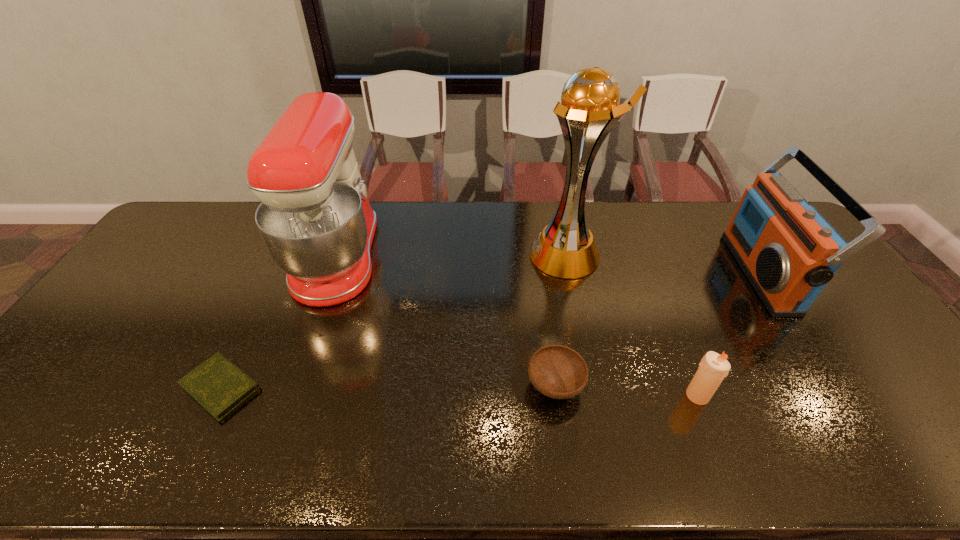
The height and width of the screenshot is (540, 960). What are the coordinates of `blank space that satisfies the following two spatial constraints: 1. on the front side of the candle; 2. on the left side of the shortest object` in the screenshot? It's located at [x=217, y=395].

This screenshot has height=540, width=960. In order to click on vacant area in the image that satisfies the following two spatial constraints: 1. on the front-facing side of the fifth tallest object; 2. on the left side of the mixer in this screenshot , I will do `click(293, 386)`.

Locate an element on the screen. This screenshot has height=540, width=960. free region that satisfies the following two spatial constraints: 1. on the front-facing side of the second object from right to left; 2. on the left side of the second tallest object is located at coordinates (290, 395).

Where is `vacant space that satisfies the following two spatial constraints: 1. on the front-facing side of the fifth object from left to right; 2. on the right side of the second tallest object`? vacant space that satisfies the following two spatial constraints: 1. on the front-facing side of the fifth object from left to right; 2. on the right side of the second tallest object is located at coordinates (290, 395).